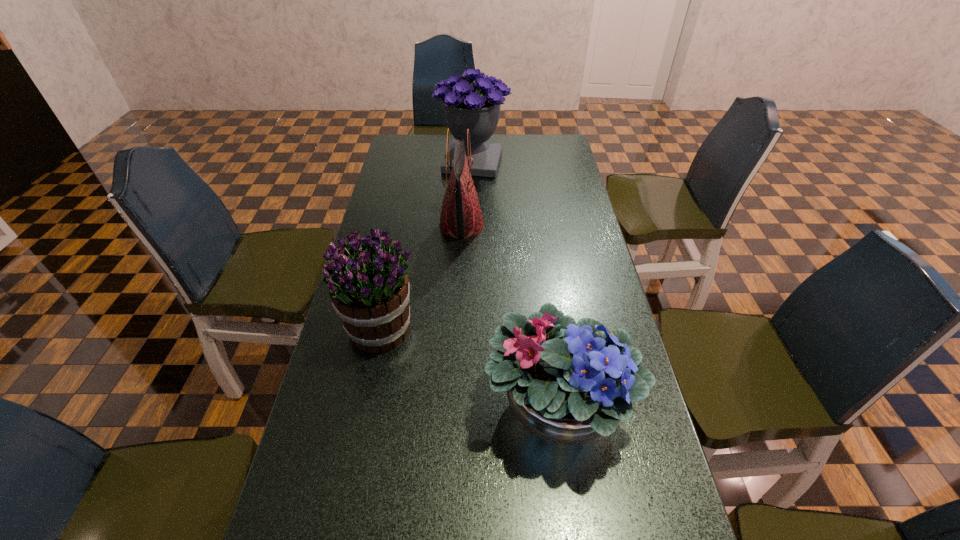
Locate an element on the screen. object located at the left edge is located at coordinates (369, 288).

Locate an element on the screen. This screenshot has width=960, height=540. object that is positioned at the right edge is located at coordinates (567, 383).

The width and height of the screenshot is (960, 540). In order to click on vacant point at the far edge in this screenshot , I will do `click(520, 161)`.

Where is `vacant space at the left edge`? The image size is (960, 540). vacant space at the left edge is located at coordinates (413, 244).

In the image, there is a desktop. Find the location of `vacant space at the right edge`. vacant space at the right edge is located at coordinates (554, 201).

The width and height of the screenshot is (960, 540). I want to click on vacant area at the far right corner, so click(x=530, y=142).

You are a GUI agent. You are given a task and a screenshot of the screen. Output one action in this format:
    pyautogui.click(x=<x>, y=<y>)
    Task: Click on the free space between the tallest bouquet and the shortest bouquet
    Image resolution: width=960 pixels, height=540 pixels.
    Given the screenshot: What is the action you would take?
    pyautogui.click(x=516, y=284)

Find the location of a particular element. This screenshot has width=960, height=540. free space between the second tallest bouquet and the farthest bouquet is located at coordinates (427, 246).

Locate an element on the screen. The height and width of the screenshot is (540, 960). free area in between the shortest bouquet and the second tallest bouquet is located at coordinates (469, 367).

The height and width of the screenshot is (540, 960). Identify the location of free space between the farthest object and the second shortest bouquet. (427, 246).